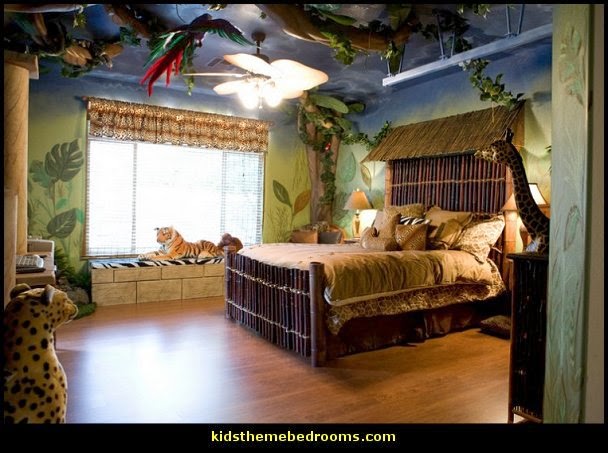
At what (x,y) coordinates should I click in order to perform the action: click on bedroom. Please return your answer as a coordinate pair (x, y). This screenshot has height=453, width=608. Looking at the image, I should click on (314, 222).